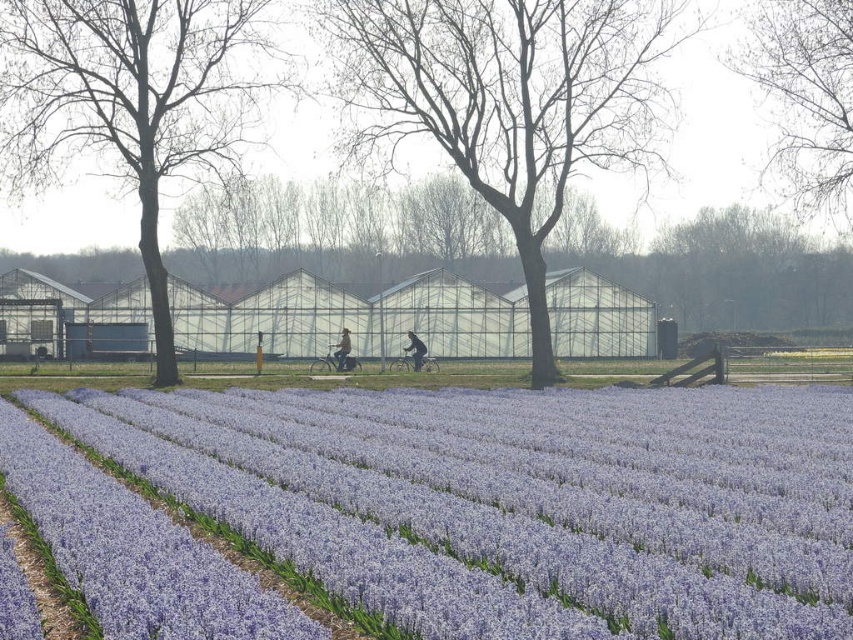
Describe the element at coordinates (508, 100) in the screenshot. I see `bare branches at center` at that location.

Which is in front, point (543, 132) or point (804, 179)?

Point (543, 132)

Where is `bare branches at center`? This screenshot has height=640, width=853. bare branches at center is located at coordinates (508, 100).

Is bare branches at center positioned before dark blue jeans at center?

Yes.

Can you confirm if bare branches at center is thinner than dark blue jeans at center?

Incorrect, bare branches at center's width is not less than dark blue jeans at center's.

At what (x,y) coordinates should I click in order to perform the action: click on bare branches at center. Please return your answer as a coordinate pair (x, y). Looking at the image, I should click on (508, 100).

Identify the location of bare branches at center. (508, 100).

Does bare wood tree at left appear under light brown leather jacket at center?

No.

Who is taller, bare wood tree at left or light brown leather jacket at center?

bare wood tree at left is taller.

Is point (115, 150) positioned after point (337, 356)?

Yes, point (115, 150) is farther from viewer.

Identify the location of bare wood tree at left. (132, 100).